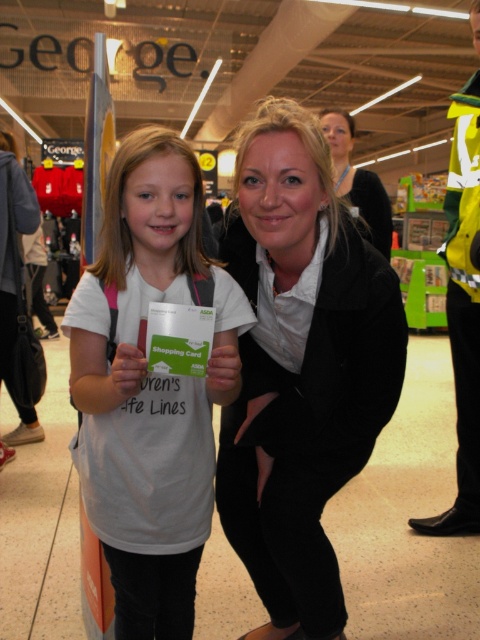
Is black matte coat at center positioned in front of white matte t-shirt at center?

No, it is behind white matte t-shirt at center.

Who is more distant from viewer, (314, 611) or (188, 573)?

The point (314, 611) is more distant.

Where is `black matte coat at center`? The height and width of the screenshot is (640, 480). black matte coat at center is located at coordinates click(300, 369).

Between black matte coat at center and matte black jacket at upper center, which one has less height?

matte black jacket at upper center is shorter.

Looking at this image, does black matte coat at center have a larger size compared to matte black jacket at upper center?

Incorrect, black matte coat at center is not larger than matte black jacket at upper center.

Find the location of `black matte coat at center`. black matte coat at center is located at coordinates (300, 369).

From the picture: Does white matte t-shirt at center have a larger size compared to matte black jacket at upper center?

Incorrect, white matte t-shirt at center is not larger than matte black jacket at upper center.

Can you confirm if white matte t-shirt at center is smaller than matte black jacket at upper center?

Yes.

Looking at this image, who is more distant from viewer, (210,515) or (370,227)?

The point (370,227) is behind.

Identify the location of white matte t-shirt at center. The image size is (480, 640). point(149,387).